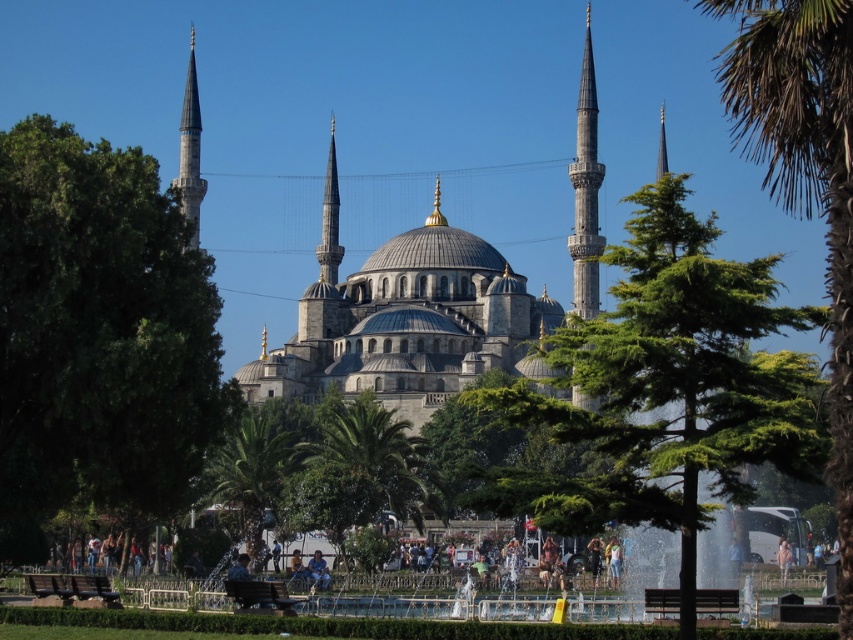
Which is in front, point (848, 24) or point (370, 436)?

Point (848, 24) is in front.

Is green leafy tree at center to the right of green leafy palm tree at center from the viewer's perspective?

Yes, green leafy tree at center is to the right of green leafy palm tree at center.

Where is `green leafy tree at center`? green leafy tree at center is located at coordinates (804, 177).

Which is above, green leafy tree at left or green leafy palm tree at lower center?

green leafy tree at left

Who is positioned more to the left, green leafy tree at left or green leafy palm tree at lower center?

From the viewer's perspective, green leafy tree at left appears more on the left side.

You are a GUI agent. You are given a task and a screenshot of the screen. Output one action in this format:
    pyautogui.click(x=<x>, y=<y>)
    Task: Click on the green leafy tree at left
    The image size is (853, 640).
    Given the screenshot: What is the action you would take?
    pyautogui.click(x=97, y=337)

Image resolution: width=853 pixels, height=640 pixels. I want to click on green leafy tree at left, so click(97, 337).

How far apart are wooden park bench at lower center and dark brown wooden bench at lower center?

The distance of wooden park bench at lower center from dark brown wooden bench at lower center is 70.91 feet.

Which is in front, point (238, 600) or point (669, 593)?

Point (669, 593) is more forward.

Identify the location of wooden park bench at lower center. (260, 596).

The width and height of the screenshot is (853, 640). Identify the location of wooden park bench at lower center. pyautogui.click(x=260, y=596).